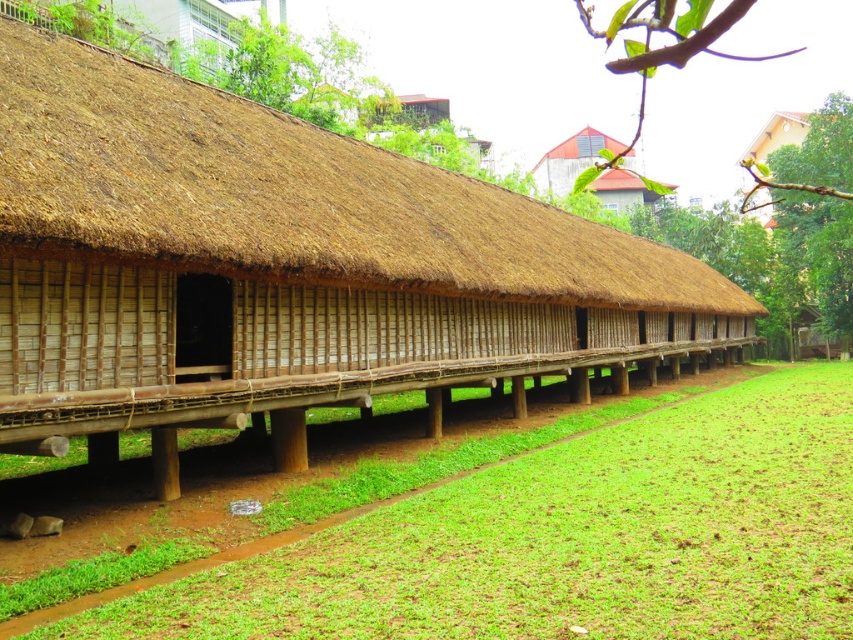
Does green grass at lower center have a smaller size compared to matte brown thatched roof hut at upper center?

Yes.

Can you confirm if green grass at lower center is positioned to the left of matte brown thatched roof hut at upper center?

Correct, you'll find green grass at lower center to the left of matte brown thatched roof hut at upper center.

Is point (721, 528) positioned behind point (624, 198)?

No, (721, 528) is closer to viewer.

Locate an element on the screen. The height and width of the screenshot is (640, 853). green grass at lower center is located at coordinates (572, 540).

Who is positioned more to the right, brown thatch roof at center or green grass at lower center?

green grass at lower center is more to the right.

Between brown thatch roof at center and green grass at lower center, which one has less height?

With less height is green grass at lower center.

The image size is (853, 640). Describe the element at coordinates (283, 268) in the screenshot. I see `brown thatch roof at center` at that location.

You are a GUI agent. You are given a task and a screenshot of the screen. Output one action in this format:
    pyautogui.click(x=<x>, y=<y>)
    Task: Click on the brown thatch roof at center
    
    Given the screenshot: What is the action you would take?
    pyautogui.click(x=283, y=268)

Does brown thatch roof at center have a greater height compared to matte brown thatched roof hut at upper center?

Incorrect, brown thatch roof at center's height is not larger of matte brown thatched roof hut at upper center's.

How distant is brown thatch roof at center from matte brown thatched roof hut at upper center?

16.83 meters

Which is in front, point (519, 227) or point (630, 198)?

Point (519, 227)

Identify the location of brown thatch roof at center. Image resolution: width=853 pixels, height=640 pixels. (283, 268).